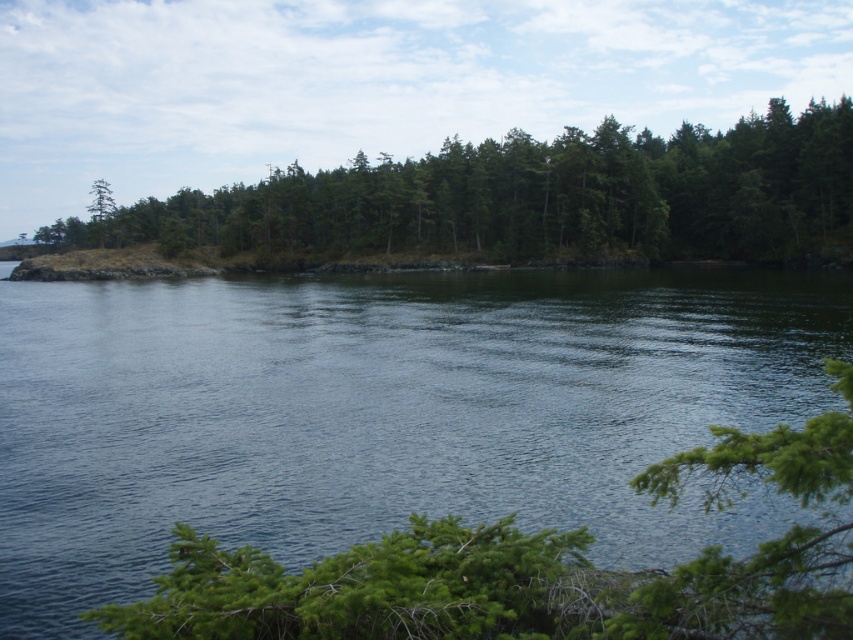
Between blue water at center and green textured trees at center, which one is positioned higher?

green textured trees at center is higher up.

Is blue water at center positioned at the back of green textured trees at center?

No, blue water at center is closer to the viewer.

Who is more distant from viewer, (x=120, y=572) or (x=799, y=196)?

The point (x=799, y=196) is behind.

Image resolution: width=853 pixels, height=640 pixels. I want to click on blue water at center, so click(374, 412).